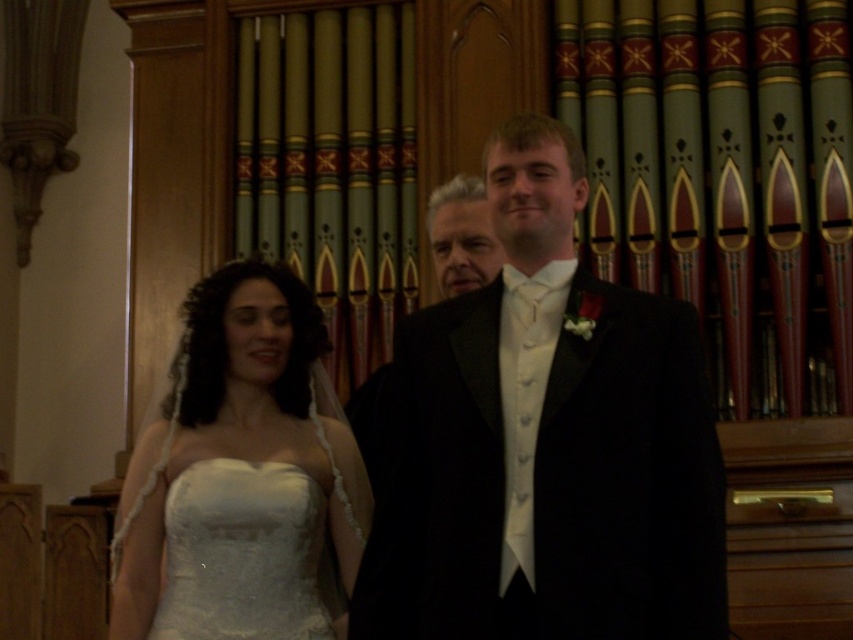
Between velvet black suit at center and white satin dress at center, which one appears on the left side from the viewer's perspective?

From the viewer's perspective, white satin dress at center appears more on the left side.

Between velvet black suit at center and white satin dress at center, which one has more height?

velvet black suit at center is taller.

Image resolution: width=853 pixels, height=640 pixels. Identify the location of velvet black suit at center. (543, 442).

Does white satin dress at center have a greater height compared to white satin dress at lower left?

Correct, white satin dress at center is much taller as white satin dress at lower left.

Identify the location of white satin dress at center. This screenshot has width=853, height=640. (241, 468).

Identify the location of white satin dress at center. (241, 468).

Identify the location of white satin dress at lower left. (244, 554).

Which is in front, point (276, 547) or point (480, 253)?

Point (276, 547) is more forward.

The width and height of the screenshot is (853, 640). I want to click on white satin dress at lower left, so click(x=244, y=554).